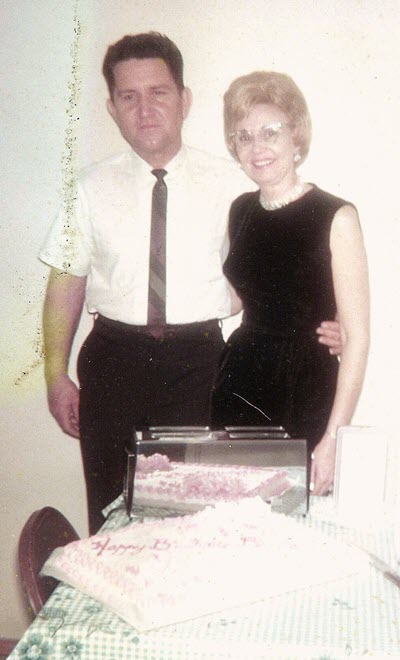
Locate an element on the screen. green flowers on table cloth is located at coordinates (42, 647), (66, 649).